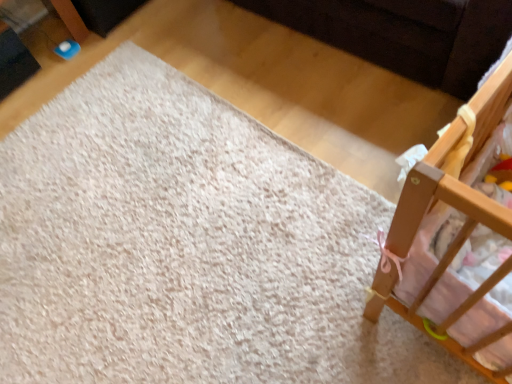
Question: Is wooden crib at right taller or shorter than white soft carpet at upper left?

Choices:
 (A) tall
 (B) short

Answer: (A)

Question: In the image, is wooden crib at right positioned in front of or behind white soft carpet at upper left?

Choices:
 (A) front
 (B) behind

Answer: (A)

Question: Considering the positions of wooden crib at right and white soft carpet at upper left in the image, is wooden crib at right wider or thinner than white soft carpet at upper left?

Choices:
 (A) wide
 (B) thin

Answer: (B)

Question: From the image's perspective, is white soft carpet at upper left positioned above or below wooden crib at right?

Choices:
 (A) above
 (B) below

Answer: (B)

Question: Looking at their shapes, would you say white soft carpet at upper left is wider or thinner than wooden crib at right?

Choices:
 (A) thin
 (B) wide

Answer: (B)

Question: From a real-world perspective, is white soft carpet at upper left positioned above or below wooden crib at right?

Choices:
 (A) above
 (B) below

Answer: (B)

Question: Do you think white soft carpet at upper left is within wooden crib at right, or outside of it?

Choices:
 (A) inside
 (B) outside

Answer: (B)